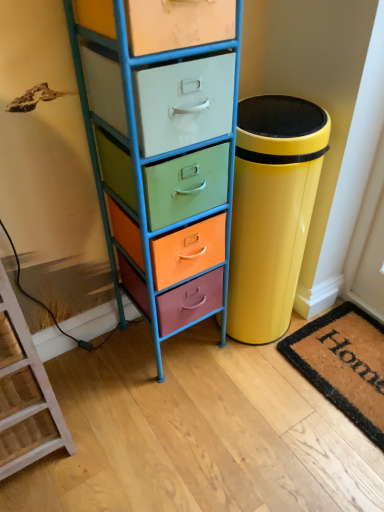
At what (x,y) coordinates should I click in order to perform the action: click on vacant point to the right of wooden ladder at lower left. Please return your answer as a coordinate pair (x, y). Image resolution: width=384 pixels, height=512 pixels. Looking at the image, I should click on (114, 423).